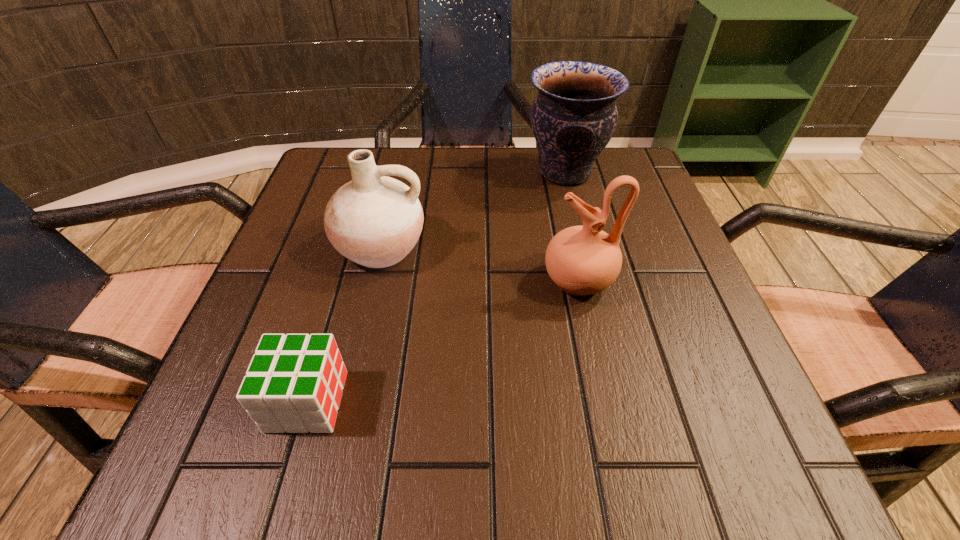
The width and height of the screenshot is (960, 540). What are the coordinates of `vacant region at the near left corner of the desktop` in the screenshot? It's located at (179, 475).

The height and width of the screenshot is (540, 960). Identify the location of free space at the far right corner of the desktop. (613, 159).

What are the coordinates of `free space at the near right corner` in the screenshot? It's located at (732, 456).

In order to click on free spot between the leftmost pottery and the shortest object in this screenshot , I will do `click(344, 324)`.

The width and height of the screenshot is (960, 540). What are the coordinates of `unoccupied area between the leftmost pottery and the farthest pottery` in the screenshot? It's located at (473, 210).

This screenshot has width=960, height=540. Find the location of `free spot between the farthest object and the leftmost pottery`. free spot between the farthest object and the leftmost pottery is located at coordinates (473, 210).

Where is `vacant point located between the nearest object and the farthest pottery`? The width and height of the screenshot is (960, 540). vacant point located between the nearest object and the farthest pottery is located at coordinates (436, 287).

Where is `empty space that is in between the farthest pottery and the shortest object`? empty space that is in between the farthest pottery and the shortest object is located at coordinates (436, 287).

The height and width of the screenshot is (540, 960). I want to click on free space between the shortest object and the leftmost pottery, so click(344, 324).

Locate an element on the screen. empty location between the leftmost pottery and the farthest object is located at coordinates (473, 210).